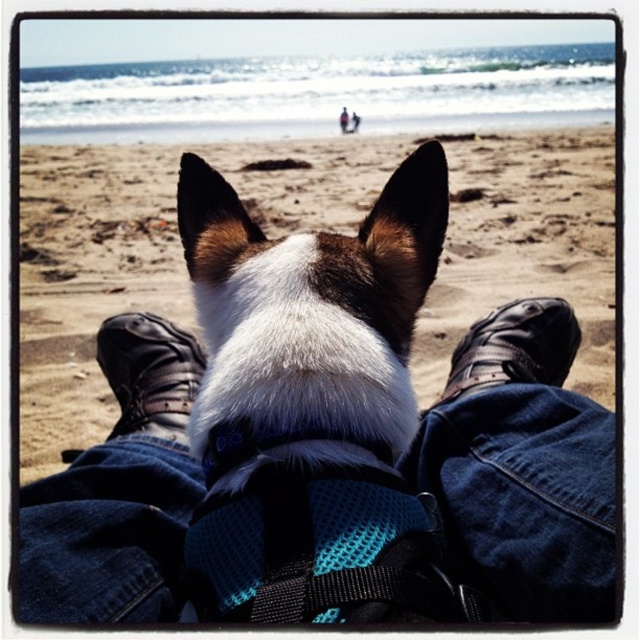
Question: Based on their relative distances, which object is farther from the white fur at center?

Choices:
 (A) leather boot at lower center
 (B) black leather shoe at lower center

Answer: (B)

Question: Which point is closer to the camera?

Choices:
 (A) white fur at center
 (B) black leather shoe at lower center
 (C) white fur dog at center

Answer: (A)

Question: Does leather boot at lower center have a larger size compared to black leather shoe at lower center?

Choices:
 (A) yes
 (B) no

Answer: (B)

Question: From the image, what is the correct spatial relationship of leather boot at lower center in relation to black leather shoe at lower center?

Choices:
 (A) above
 (B) below

Answer: (B)

Question: Among these objects, which one is farthest from the camera?

Choices:
 (A) leather boot at lower center
 (B) black leather shoe at lower center
 (C) white fur dog at center
 (D) white fur at center

Answer: (C)

Question: Can you confirm if white fur dog at center is bigger than leather boot at lower center?

Choices:
 (A) no
 (B) yes

Answer: (B)